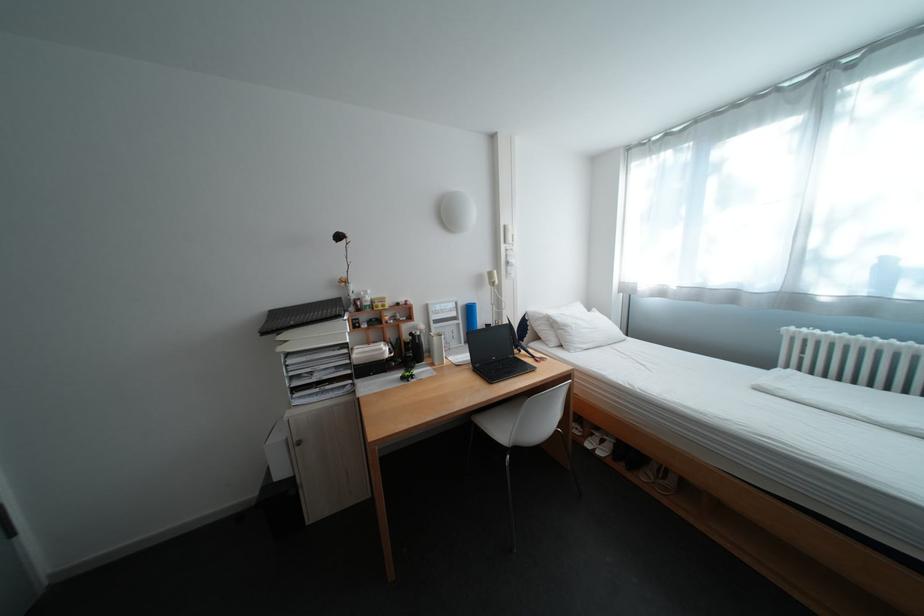
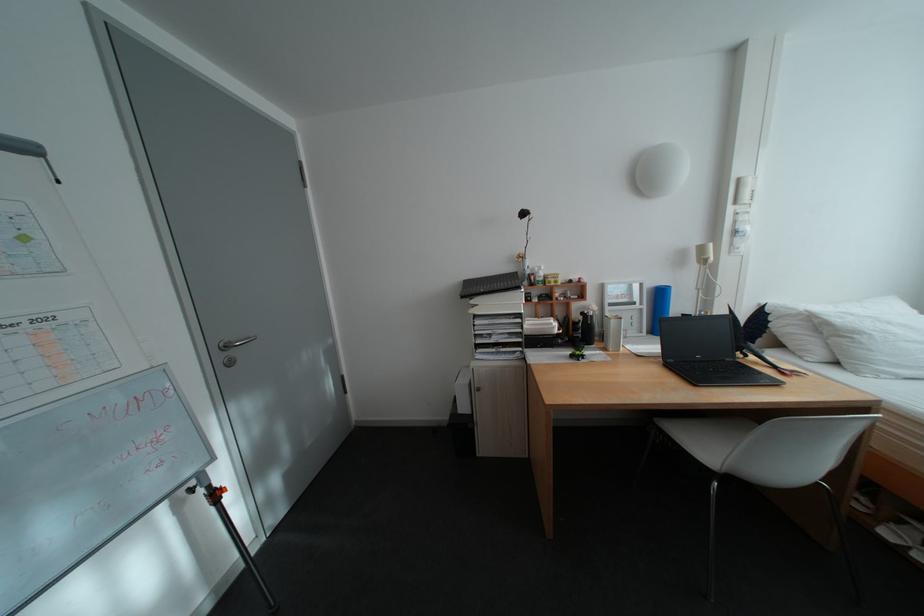
Locate, in the second image, the point that corresponds to point (472, 322) in the first image.

(657, 307)